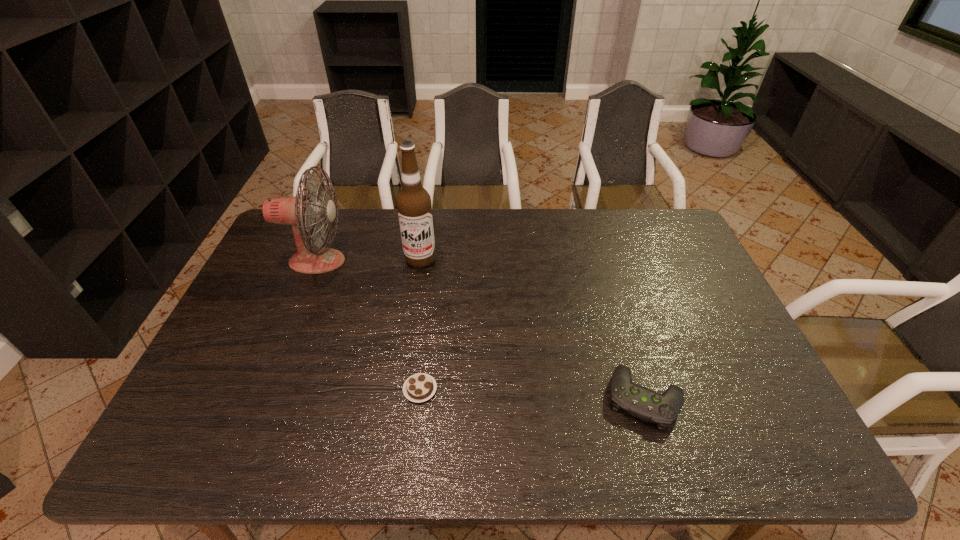
Where is `object that can be found as the closest to the third tallest object`? The image size is (960, 540). object that can be found as the closest to the third tallest object is located at coordinates (420, 387).

Where is `object that is the second closest to the alcohol`? This screenshot has height=540, width=960. object that is the second closest to the alcohol is located at coordinates (420, 387).

Locate an element on the screen. This screenshot has height=540, width=960. free space that satisfies the following two spatial constraints: 1. on the label of the shortest object; 2. on the left side of the tallest object is located at coordinates (401, 389).

Identify the location of free space in the image that satisfies the following two spatial constraints: 1. on the back side of the shortest object; 2. in front of the third shortest object to direct airflow. Image resolution: width=960 pixels, height=540 pixels. (435, 261).

Find the location of a particular element. The height and width of the screenshot is (540, 960). free location that satisfies the following two spatial constraints: 1. on the back side of the control; 2. in front of the third shortest object to direct airflow is located at coordinates (602, 261).

Locate an element on the screen. vacant space that satisfies the following two spatial constraints: 1. on the label of the tallest object; 2. on the left side of the second shortest object is located at coordinates (399, 398).

Where is `vacant space that satisfies the following two spatial constraints: 1. in front of the second tallest object to direct airflow; 2. on the left side of the control`? vacant space that satisfies the following two spatial constraints: 1. in front of the second tallest object to direct airflow; 2. on the left side of the control is located at coordinates (261, 398).

Where is `free spot that satisfies the following two spatial constraints: 1. on the label of the tallest object; 2. on the left side of the chocolate cake`? free spot that satisfies the following two spatial constraints: 1. on the label of the tallest object; 2. on the left side of the chocolate cake is located at coordinates (401, 389).

Locate an element on the screen. The height and width of the screenshot is (540, 960). vacant space that satisfies the following two spatial constraints: 1. in front of the fan to direct airflow; 2. on the left side of the rightmost object is located at coordinates (261, 398).

At what (x,y) coordinates should I click in order to perform the action: click on free space that satisfies the following two spatial constraints: 1. in front of the second tallest object to direct airflow; 2. on the back side of the rightmost object. Please return your answer as a coordinate pair (x, y). Looking at the image, I should click on (261, 398).